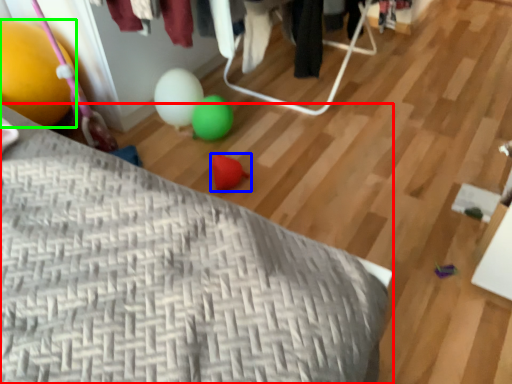
Question: Based on their relative distances, which object is nearer to furniture (highlighted by a red box)? Choose from toy (highlighted by a blue box) and balloon (highlighted by a green box).

Choices:
 (A) toy
 (B) balloon

Answer: (B)